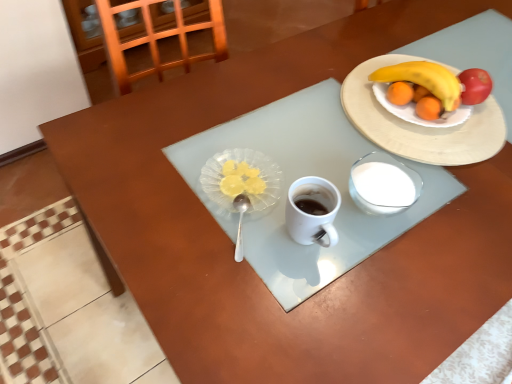
Identify the location of empty space that is to the right of translucent glass plate at center. The height and width of the screenshot is (384, 512). (315, 175).